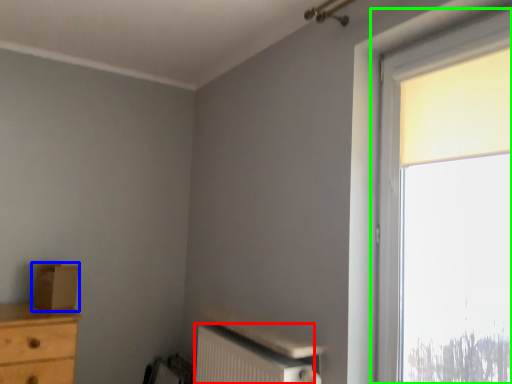
Question: Based on their relative distances, which object is farther from radiator (highlighted by a red box)? Choose from cardboard box (highlighted by a blue box) and window (highlighted by a green box).

Choices:
 (A) cardboard box
 (B) window

Answer: (A)